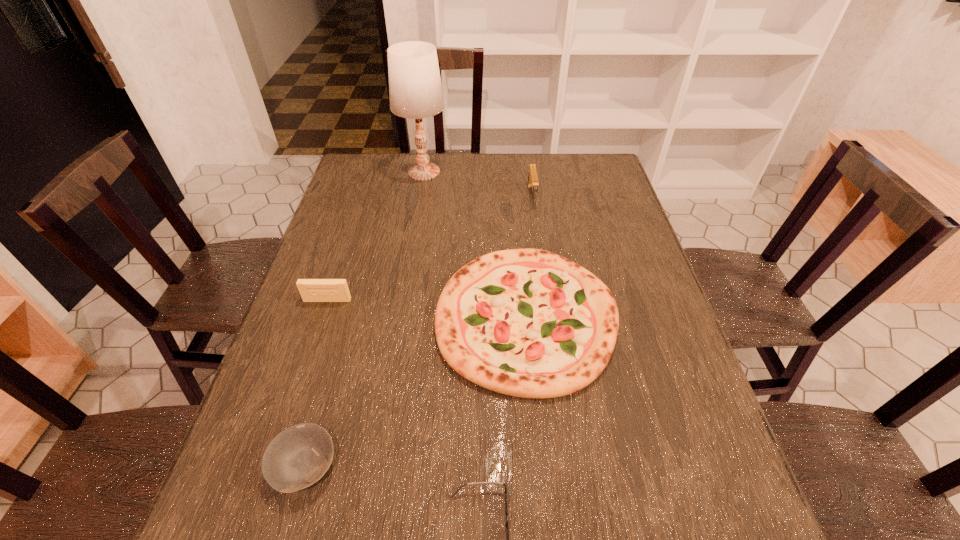
Where is `free spot that satisfies the following two spatial constraints: 1. at the front of the videotape with spools; 2. on the right side of the bowl`? free spot that satisfies the following two spatial constraints: 1. at the front of the videotape with spools; 2. on the right side of the bowl is located at coordinates (273, 466).